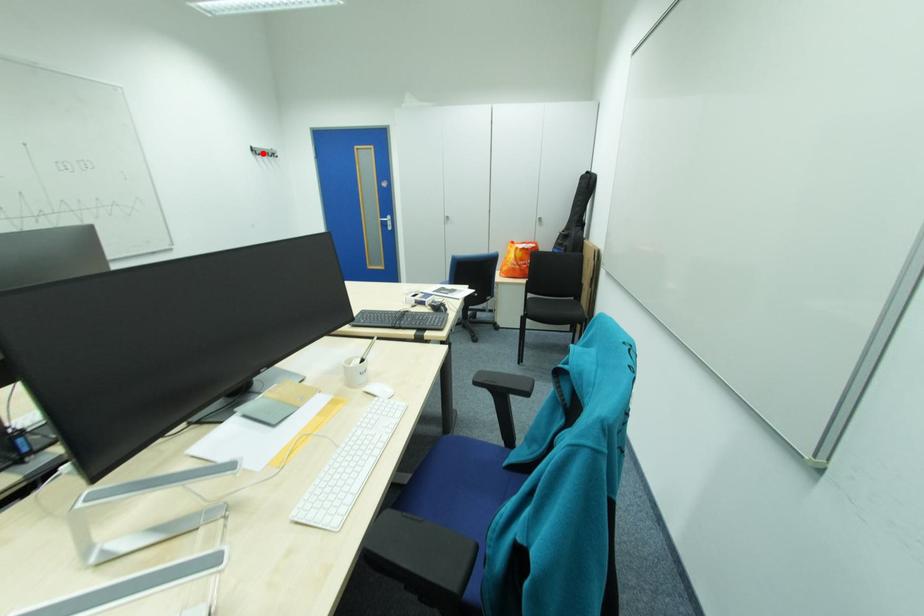
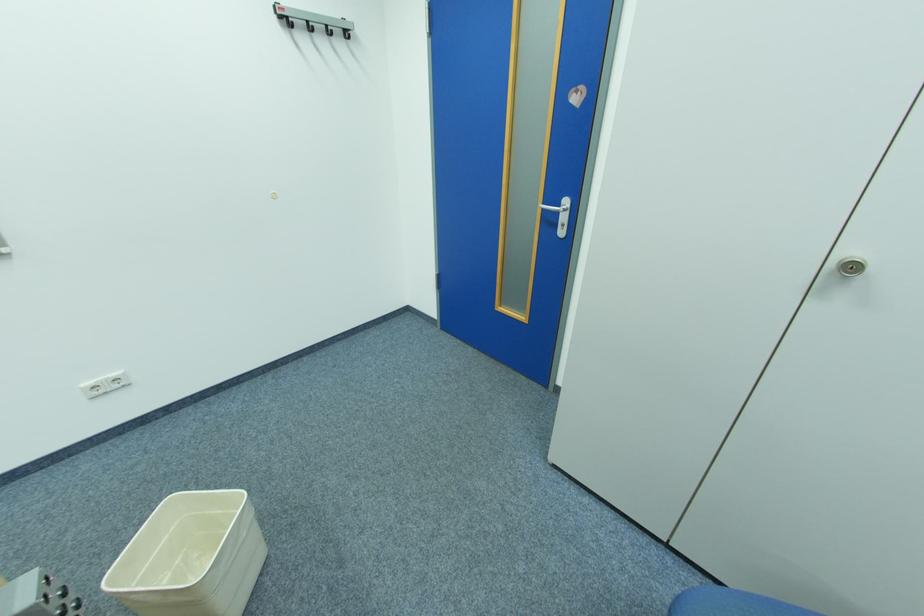
In the second image, find the point that corresponds to the highlighted location in the first image.

(290, 25)